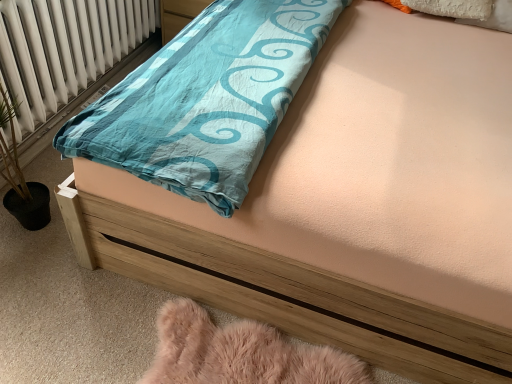
Question: Should I look upward or downward to see white radiator at left?

Choices:
 (A) down
 (B) up

Answer: (B)

Question: Is white radiator at left oriented towards fuzzy pink rug at lower left?

Choices:
 (A) yes
 (B) no

Answer: (B)

Question: Can you confirm if white radiator at left is positioned to the left of fuzzy pink rug at lower left?

Choices:
 (A) yes
 (B) no

Answer: (A)

Question: Is the depth of white radiator at left greater than that of fuzzy pink rug at lower left?

Choices:
 (A) no
 (B) yes

Answer: (B)

Question: From the image's perspective, is white radiator at left beneath fuzzy pink rug at lower left?

Choices:
 (A) no
 (B) yes

Answer: (A)

Question: Is white radiator at left not near fuzzy pink rug at lower left?

Choices:
 (A) yes
 (B) no

Answer: (A)

Question: Is white radiator at left oriented away from fuzzy pink rug at lower left?

Choices:
 (A) no
 (B) yes

Answer: (A)

Question: Is fuzzy pink rug at lower left to the left of white radiator at left from the viewer's perspective?

Choices:
 (A) yes
 (B) no

Answer: (B)

Question: From the image's perspective, is fuzzy pink rug at lower left above white radiator at left?

Choices:
 (A) no
 (B) yes

Answer: (A)

Question: Can you confirm if fuzzy pink rug at lower left is wider than white radiator at left?

Choices:
 (A) yes
 (B) no

Answer: (B)

Question: Is fuzzy pink rug at lower left shorter than white radiator at left?

Choices:
 (A) no
 (B) yes

Answer: (B)

Question: Is fuzzy pink rug at lower left completely or partially outside of white radiator at left?

Choices:
 (A) no
 (B) yes

Answer: (B)

Question: Is fuzzy pink rug at lower left positioned with its back to white radiator at left?

Choices:
 (A) yes
 (B) no

Answer: (B)

Question: Looking at the image, does fuzzy pink rug at lower left seem bigger or smaller compared to white radiator at left?

Choices:
 (A) small
 (B) big

Answer: (A)